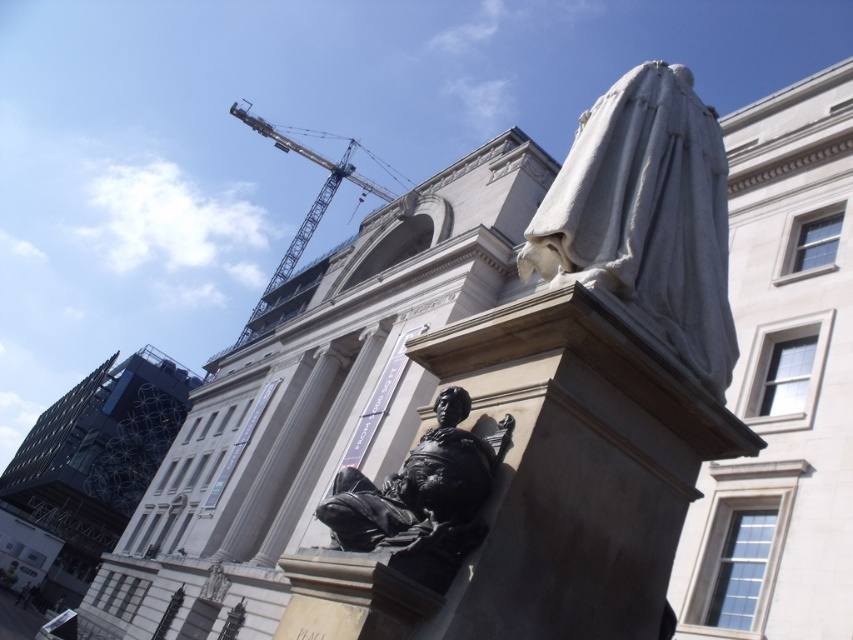
Question: Which of the following is the farthest from the observer?

Choices:
 (A) (453, 432)
 (B) (320, 189)

Answer: (B)

Question: Which of the following is the farthest from the observer?

Choices:
 (A) (418, 536)
 (B) (267, 131)
 (C) (590, 193)

Answer: (B)

Question: From the image, what is the correct spatial relationship of white marble statue at upper right in relation to yellow metallic crane at upper center?

Choices:
 (A) above
 (B) below

Answer: (B)

Question: Is white marble statue at upper right smaller than black polished statue at lower center?

Choices:
 (A) no
 (B) yes

Answer: (A)

Question: Is the position of black polished statue at lower center more distant than that of yellow metallic crane at upper center?

Choices:
 (A) yes
 (B) no

Answer: (B)

Question: Estimate the real-world distances between objects in this image. Which object is farther from the black polished statue at lower center?

Choices:
 (A) yellow metallic crane at upper center
 (B) white marble statue at upper right

Answer: (A)